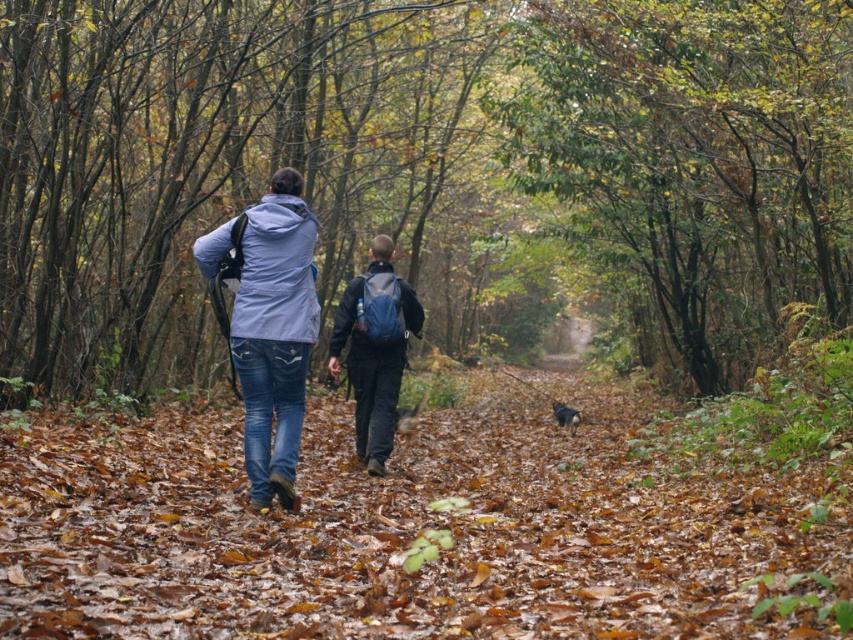
Between point (393, 276) and point (575, 426), which one is positioned behind?

Positioned behind is point (575, 426).

Describe the element at coordinates (374, 356) in the screenshot. The width and height of the screenshot is (853, 640). I see `blue backpack at center` at that location.

Which is in front, point (381, 250) or point (570, 422)?

Positioned in front is point (381, 250).

Image resolution: width=853 pixels, height=640 pixels. In order to click on blue backpack at center in this screenshot , I will do `click(374, 356)`.

Is brown leafy forest path at center positioned in front of blue backpack at center?

Yes, it is.

Image resolution: width=853 pixels, height=640 pixels. What do you see at coordinates (419, 529) in the screenshot? I see `brown leafy forest path at center` at bounding box center [419, 529].

Between point (543, 625) and point (376, 260), which one is positioned in front?

Point (543, 625) is in front.

This screenshot has height=640, width=853. What are the coordinates of `brown leafy forest path at center` in the screenshot? It's located at (419, 529).

Is brown leafy forest path at center below matte blue jacket at center?

Correct, brown leafy forest path at center is located below matte blue jacket at center.

Does brown leafy forest path at center have a lesser height compared to matte blue jacket at center?

Yes.

Describe the element at coordinates (419, 529) in the screenshot. I see `brown leafy forest path at center` at that location.

The width and height of the screenshot is (853, 640). Identify the location of brown leafy forest path at center. (419, 529).